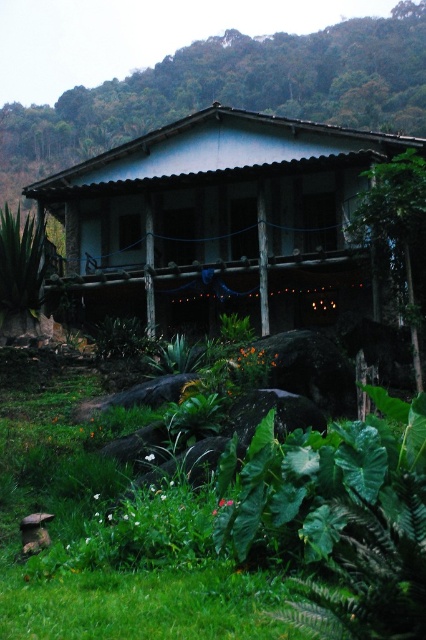
Question: Can you confirm if green leafy plant at lower center is positioned below wooden hut at center?

Choices:
 (A) no
 (B) yes

Answer: (B)

Question: Can you confirm if green leafy plant at lower center is thinner than wooden hut at center?

Choices:
 (A) yes
 (B) no

Answer: (A)

Question: Can you confirm if green leafy plant at lower center is bigger than wooden hut at center?

Choices:
 (A) no
 (B) yes

Answer: (A)